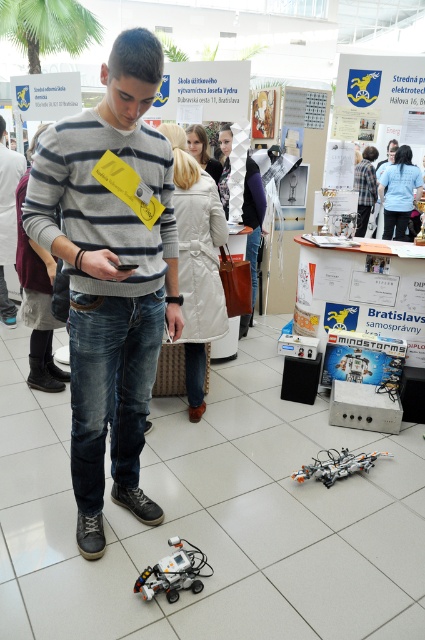
Which is more to the right, striped knit sweater at center or orange metallic robot at lower center?

orange metallic robot at lower center

Is striped knit sweater at center taller than orange metallic robot at lower center?

Yes, striped knit sweater at center is taller than orange metallic robot at lower center.

Measure the distance between point (132, 273) and camera.

A distance of 6.14 feet exists between point (132, 273) and camera.

Image resolution: width=425 pixels, height=640 pixels. What are the coordinates of `striped knit sweater at center` in the screenshot? It's located at (110, 275).

Is striped knit sweater at center bigger than white plastic robot at lower center?

Correct, striped knit sweater at center is larger in size than white plastic robot at lower center.

Measure the distance between striped knit sweater at center and camera.

A distance of 1.54 meters exists between striped knit sweater at center and camera.

Is point (139, 266) closer to camera compared to point (180, 564)?

Yes, point (139, 266) is in front of point (180, 564).

Locate an element on the screen. This screenshot has width=425, height=640. striped knit sweater at center is located at coordinates (110, 275).

Can you confirm if white plastic robot at lower center is positioned to the left of orange metallic robot at lower center?

Yes, white plastic robot at lower center is to the left of orange metallic robot at lower center.

Measure the distance between white plastic robot at lower center and orange metallic robot at lower center.

35.53 inches

Is point (184, 552) in front of point (345, 465)?

Yes, point (184, 552) is in front of point (345, 465).

Identify the location of white plastic robot at lower center. The image size is (425, 640). (173, 572).